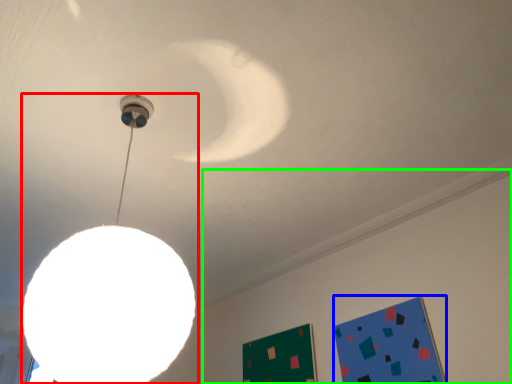
Question: Which object is positioned farthest from lamp (highlighted by a red box)? Select from bulletin board (highlighted by a blue box) and backdrop (highlighted by a green box).

Choices:
 (A) bulletin board
 (B) backdrop

Answer: (B)